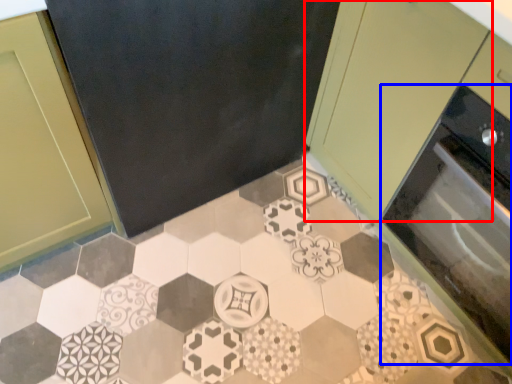
Question: Which of the following is the farthest to the observer, cabinetry (highlighted by a red box) or oven (highlighted by a blue box)?

Choices:
 (A) cabinetry
 (B) oven

Answer: (B)